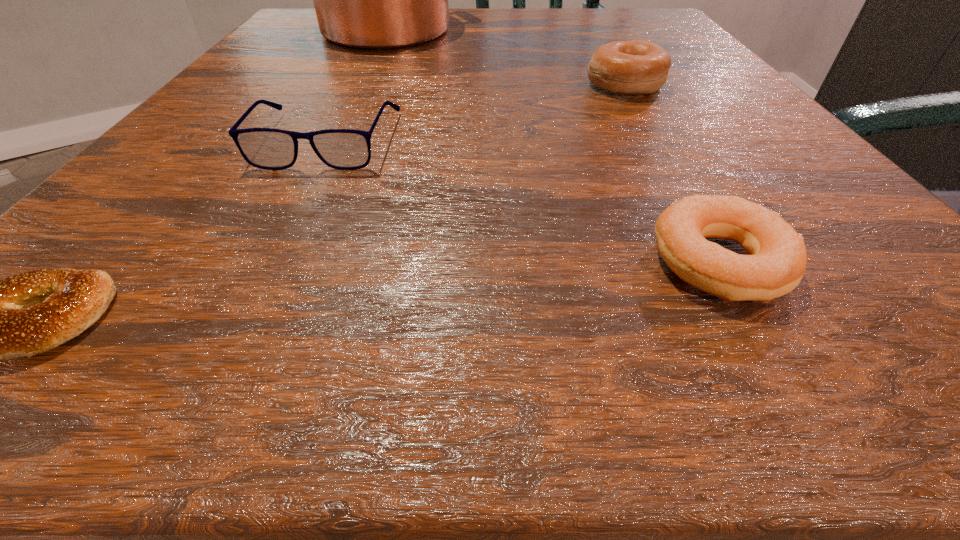
The height and width of the screenshot is (540, 960). In order to click on object situated at the far edge in this screenshot , I will do `click(370, 0)`.

At what (x,y) coordinates should I click in order to perform the action: click on object at the near edge. Please return your answer as a coordinate pair (x, y). Image resolution: width=960 pixels, height=540 pixels. Looking at the image, I should click on (776, 261).

Find the location of a particular element. saucepan at the left edge is located at coordinates (370, 0).

This screenshot has height=540, width=960. What are the coordinates of `spectacles located at the left edge` in the screenshot? It's located at (266, 148).

The width and height of the screenshot is (960, 540). I want to click on object positioned at the far left corner, so click(370, 0).

Find the location of a particular element. The image size is (960, 540). object that is positioned at the near right corner is located at coordinates 776,261.

In the image, there is a desktop. Where is `vacant space at the far edge`? vacant space at the far edge is located at coordinates (472, 25).

The width and height of the screenshot is (960, 540). Find the location of `blank space at the near edge of the desktop`. blank space at the near edge of the desktop is located at coordinates tap(281, 316).

The image size is (960, 540). What are the coordinates of `vacant area at the left edge` in the screenshot? It's located at (154, 166).

This screenshot has height=540, width=960. Find the location of `vacant space at the right edge of the desktop`. vacant space at the right edge of the desktop is located at coordinates (729, 160).